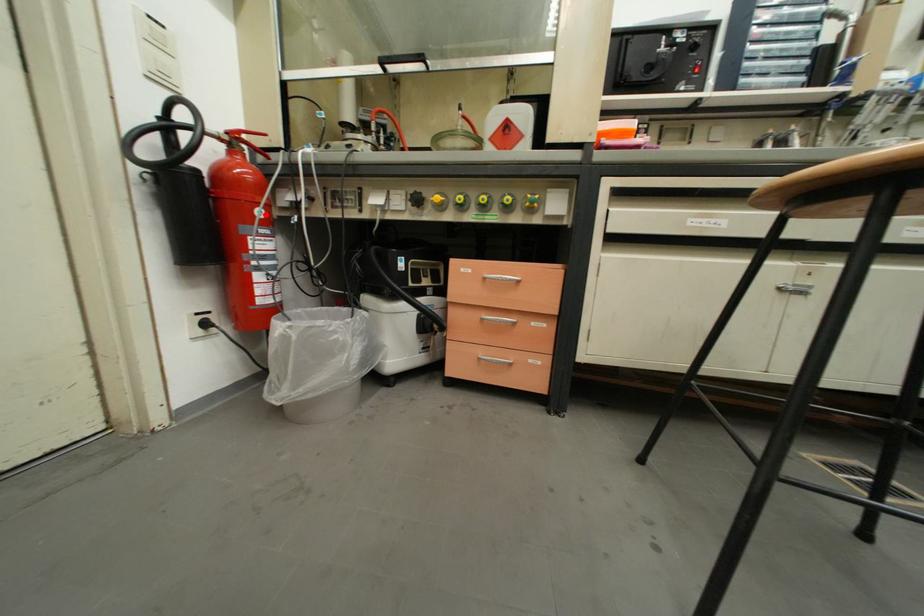
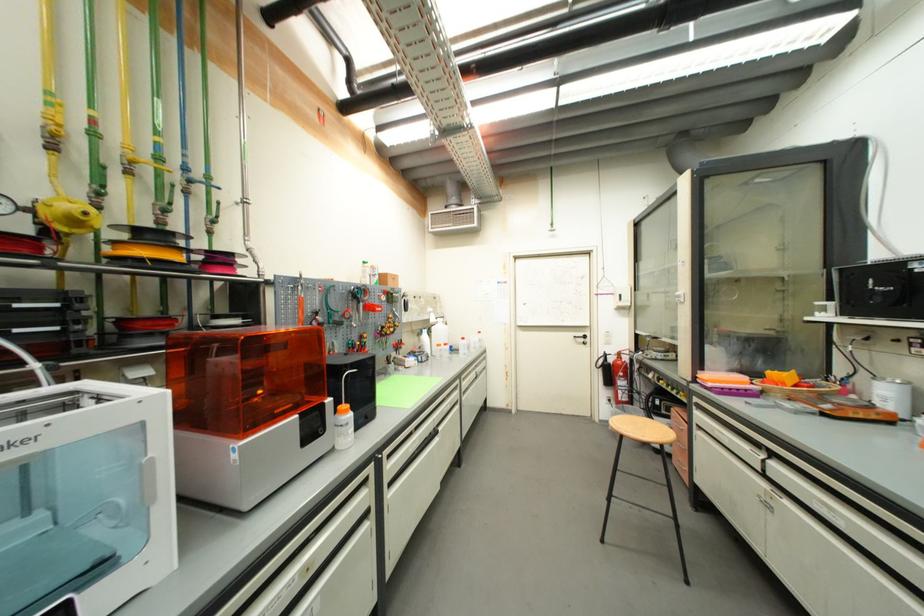
Locate, in the second image, the point that corresponds to the highlighted location in the first image.

(626, 376)